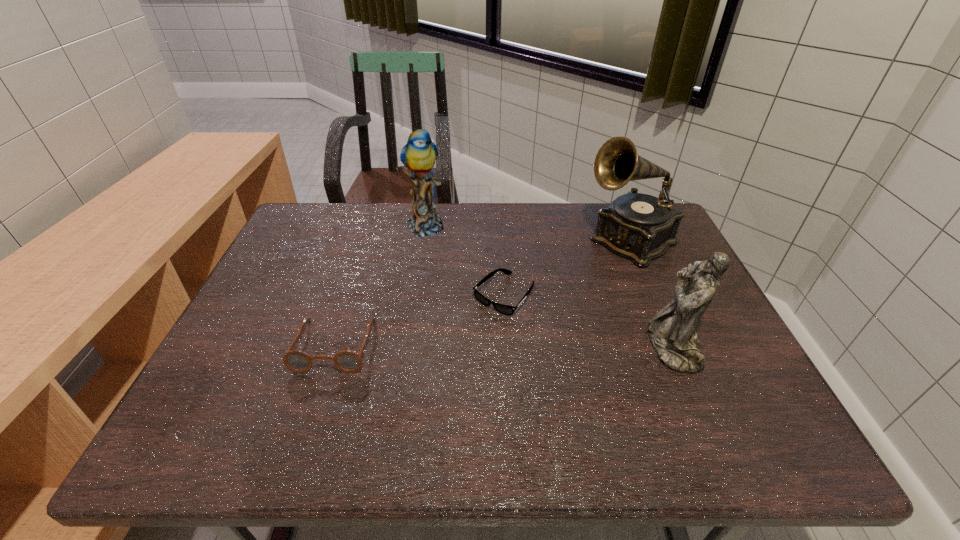
The height and width of the screenshot is (540, 960). What are the coordinates of `blank area located 0.130m on the front-facing side of the third shortest object` in the screenshot? It's located at (594, 347).

Identify the location of vacant region located on the horn of the phonograph record. Image resolution: width=960 pixels, height=540 pixels. (510, 320).

Find the location of `free space located 0.240m on the horn of the phonograph record`. free space located 0.240m on the horn of the phonograph record is located at coordinates (542, 298).

Identify the location of free space located on the horn of the phonograph record. This screenshot has height=540, width=960. (558, 287).

Identify the location of vacant space positioned 0.230m on the face of the parrot. The width and height of the screenshot is (960, 540). (471, 281).

This screenshot has height=540, width=960. I want to click on vacant position located 0.290m on the face of the parrot, so click(483, 294).

What are the coordinates of `free space located 0.330m on the face of the parrot` in the screenshot? It's located at (492, 303).

At what (x,y) coordinates should I click in order to perform the action: click on vacant region located on the front-facing side of the sunglasses. Please return your answer as a coordinate pair (x, y). Looking at the image, I should click on (399, 408).

Locate an element on the screen. The width and height of the screenshot is (960, 540). vacant area located on the front-facing side of the sunglasses is located at coordinates (468, 335).

The width and height of the screenshot is (960, 540). I want to click on blank area located 0.050m on the front-facing side of the sunglasses, so click(x=475, y=327).